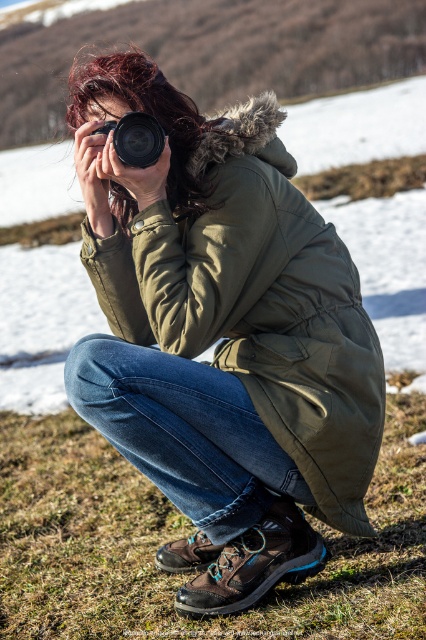
Does point (253, 221) lie in front of point (158, 138)?

Yes, it is.

Who is taller, olive green parka at center or black plastic camera at center?

Standing taller between the two is olive green parka at center.

Where is `olive green parka at center`? The height and width of the screenshot is (640, 426). olive green parka at center is located at coordinates (258, 305).

At what (x,y) coordinates should I click in order to perform the action: click on olive green parka at center. Please return your answer as a coordinate pair (x, y). This screenshot has height=640, width=426. Looking at the image, I should click on click(x=258, y=305).

Is olive green parka at center to the right of denim jeans at lower center from the viewer's perspective?

Correct, you'll find olive green parka at center to the right of denim jeans at lower center.

Does point (249, 486) lie in front of point (218, 584)?

Yes, point (249, 486) is in front of point (218, 584).

Where is `olive green parka at center`? This screenshot has height=640, width=426. olive green parka at center is located at coordinates (258, 305).

Does denim jeans at lower center lie behind black plastic camera at center?

No, denim jeans at lower center is closer to the viewer.

Does denim jeans at lower center appear over black plastic camera at center?

No, denim jeans at lower center is not above black plastic camera at center.

The image size is (426, 640). Describe the element at coordinates (201, 468) in the screenshot. I see `denim jeans at lower center` at that location.

Locate an element on the screen. The height and width of the screenshot is (640, 426). denim jeans at lower center is located at coordinates (201, 468).